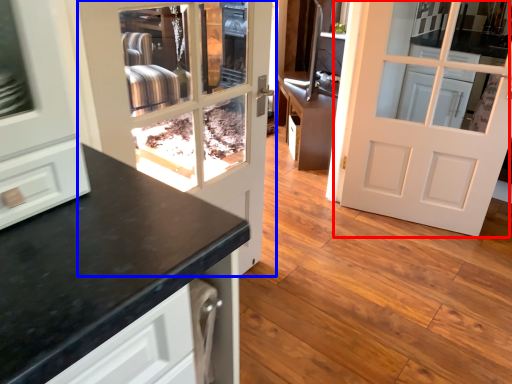
Question: Which object appears farthest to the camera in this image, door (highlighted by a red box) or door (highlighted by a blue box)?

Choices:
 (A) door
 (B) door

Answer: (A)